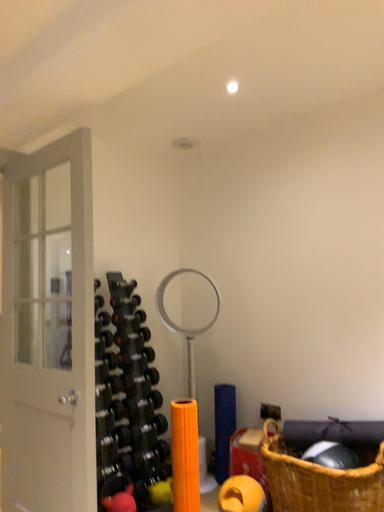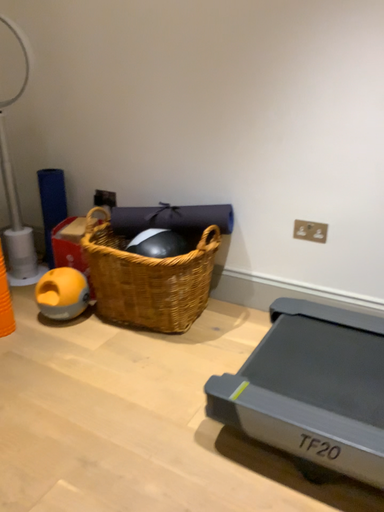
Question: How did the camera likely rotate when shooting the video?

Choices:
 (A) rotated downward
 (B) rotated upward

Answer: (A)